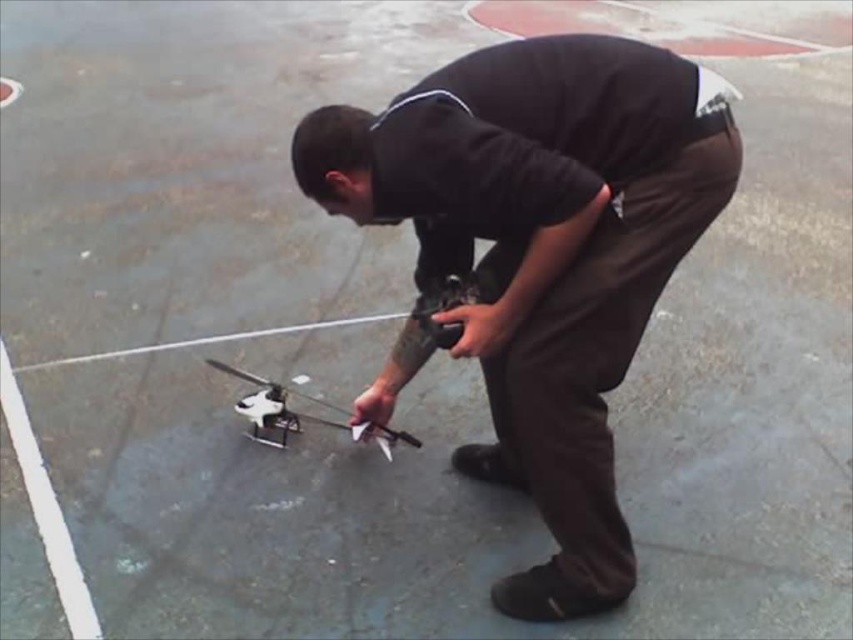
Is point (468, 173) behind point (253, 435)?

No.

Does black matte remote control at center appear on the right side of white matte drone at center?

Yes, black matte remote control at center is to the right of white matte drone at center.

Describe the element at coordinates (543, 253) in the screenshot. I see `black matte remote control at center` at that location.

The image size is (853, 640). I want to click on black matte remote control at center, so click(x=543, y=253).